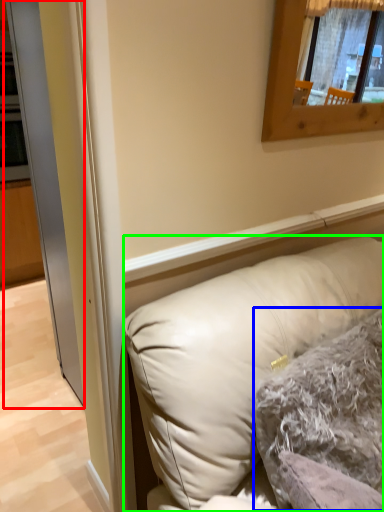
Question: Estimate the real-world distances between objects in this image. Which object is farther from glass door (highlighted by a red box), pillow (highlighted by a blue box) or pillow (highlighted by a green box)?

Choices:
 (A) pillow
 (B) pillow

Answer: (A)